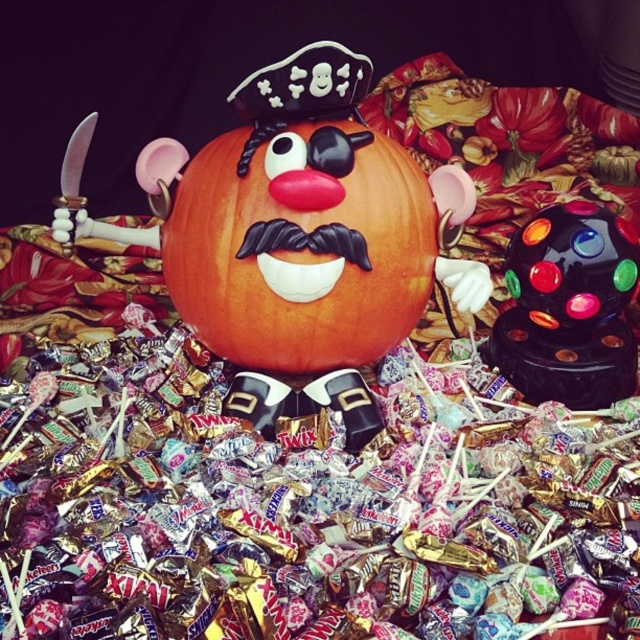
Which of these two, orange matte pumpkin at center or shiny plastic ball at center, stands taller?

orange matte pumpkin at center

Is point (276, 138) positioned before point (564, 323)?

Yes, point (276, 138) is closer to viewer.

You are a GUI agent. You are given a task and a screenshot of the screen. Output one action in this format:
    pyautogui.click(x=<x>, y=<y>)
    Task: Click on the orange matte pumpkin at center
    
    Given the screenshot: What is the action you would take?
    pyautogui.click(x=300, y=246)

Does metallic foil wrapped candy at center appear on the left side of orange matte pumpkin at center?

Correct, you'll find metallic foil wrapped candy at center to the left of orange matte pumpkin at center.

Does metallic foil wrapped candy at center have a lesser height compared to orange matte pumpkin at center?

Yes, metallic foil wrapped candy at center is shorter than orange matte pumpkin at center.

What do you see at coordinates (304, 504) in the screenshot?
I see `metallic foil wrapped candy at center` at bounding box center [304, 504].

The height and width of the screenshot is (640, 640). I want to click on metallic foil wrapped candy at center, so click(x=304, y=504).

Between metallic foil wrapped candy at center and shiny plastic ball at center, which one is positioned lower?

Positioned lower is metallic foil wrapped candy at center.

Is point (362, 545) closer to viewer compared to point (534, 348)?

Yes.

Find the location of a particular element. The height and width of the screenshot is (640, 640). metallic foil wrapped candy at center is located at coordinates (304, 504).

Image resolution: width=640 pixels, height=640 pixels. What are the coordinates of `metallic foil wrapped candy at center` in the screenshot? It's located at (304, 504).